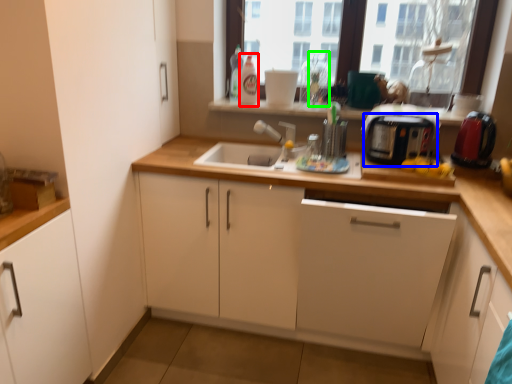
Question: Which object is positioned closest to bottle (highlighted by a red box)? Select from toaster (highlighted by a blue box) and bottle (highlighted by a green box).

Choices:
 (A) toaster
 (B) bottle

Answer: (B)